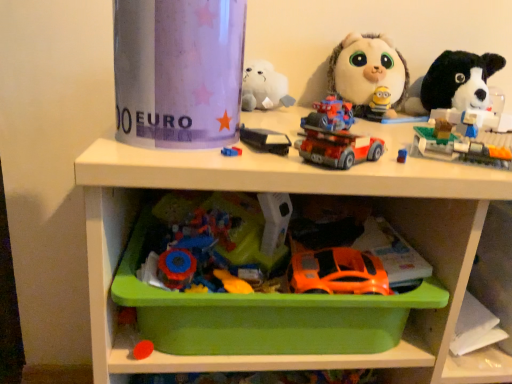
Question: Could you tell me if translucent plastic building blocks at upper right, which is the third toy from top to bottom, is turned towards green plastic tray at lower center?

Choices:
 (A) no
 (B) yes

Answer: (A)

Question: Does translucent plastic building blocks at upper right, the third toy when ordered from bottom to top, appear on the left side of green plastic tray at lower center?

Choices:
 (A) no
 (B) yes

Answer: (A)

Question: Is translucent plastic building blocks at upper right, the third toy when ordered from bottom to top, not inside green plastic tray at lower center?

Choices:
 (A) no
 (B) yes

Answer: (B)

Question: Are translucent plastic building blocks at upper right, the third toy when ordered from bottom to top, and green plastic tray at lower center beside each other?

Choices:
 (A) yes
 (B) no

Answer: (B)

Question: Is green plastic tray at lower center surrounded by translucent plastic building blocks at upper right, which is the third toy from top to bottom?

Choices:
 (A) no
 (B) yes

Answer: (A)

Question: Does translucent plastic building blocks at upper right, the third toy when ordered from bottom to top, come in front of green plastic tray at lower center?

Choices:
 (A) yes
 (B) no

Answer: (B)

Question: Is orange matte car at lower center, the 5th toy positioned from the top, positioned before fluffy white plush toy at upper right, positioned as the 1th toy in top-to-bottom order?

Choices:
 (A) no
 (B) yes

Answer: (B)

Question: Would you say orange matte car at lower center, the 1th toy from the bottom, is outside fluffy white plush toy at upper right, the 5th toy positioned from the bottom?

Choices:
 (A) no
 (B) yes

Answer: (B)

Question: Is orange matte car at lower center, the 5th toy positioned from the top, shorter than fluffy white plush toy at upper right, the 5th toy positioned from the bottom?

Choices:
 (A) yes
 (B) no

Answer: (A)

Question: From a real-world perspective, is orange matte car at lower center, the 1th toy from the bottom, physically above fluffy white plush toy at upper right, the 5th toy positioned from the bottom?

Choices:
 (A) yes
 (B) no

Answer: (B)

Question: Does orange matte car at lower center, the 1th toy from the bottom, have a lesser width compared to fluffy white plush toy at upper right, the 5th toy positioned from the bottom?

Choices:
 (A) yes
 (B) no

Answer: (A)

Question: Is orange matte car at lower center, the 1th toy from the bottom, at the right side of fluffy white plush toy at upper right, positioned as the 1th toy in top-to-bottom order?

Choices:
 (A) yes
 (B) no

Answer: (B)

Question: Could translucent plastic building blocks at upper right, which is the third toy from top to bottom, be considered to be inside orange matte car at lower center, the 5th toy positioned from the top?

Choices:
 (A) yes
 (B) no

Answer: (B)